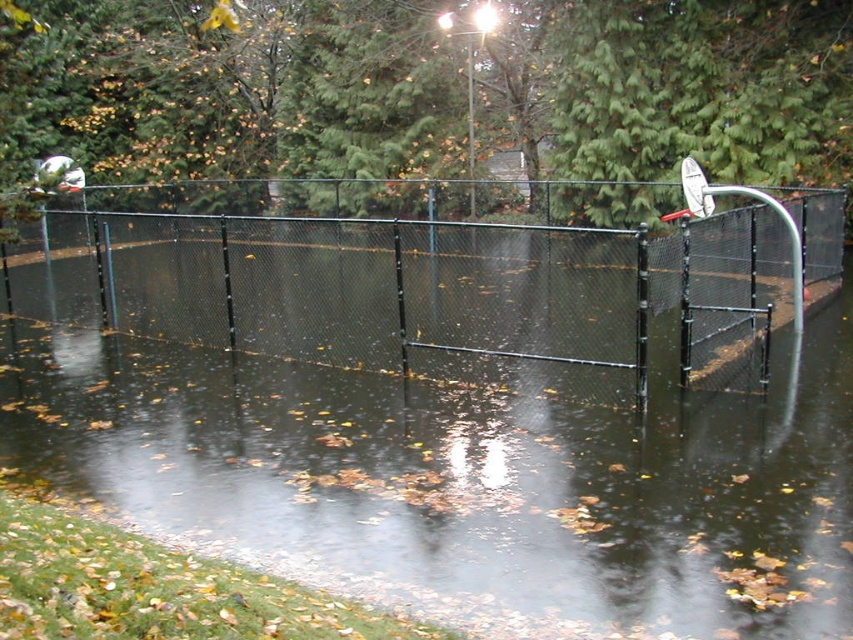
Question: Which point is closer to the camera?

Choices:
 (A) black chain-link fence at center
 (B) transparent water at center

Answer: (B)

Question: Which object is farther from the camera taking this photo?

Choices:
 (A) white matte basketball hoop at upper right
 (B) transparent water at center

Answer: (A)

Question: In this image, where is transparent water at center located relative to black chain-link fence at center?

Choices:
 (A) left
 (B) right

Answer: (A)

Question: Is transparent water at center below white matte basketball hoop at upper right?

Choices:
 (A) no
 (B) yes

Answer: (B)

Question: Based on their relative distances, which object is nearer to the white matte basketball hoop at upper right?

Choices:
 (A) black chain-link fence at center
 (B) transparent water at center

Answer: (A)

Question: Does black chain-link fence at center appear under white matte basketball hoop at upper right?

Choices:
 (A) yes
 (B) no

Answer: (B)